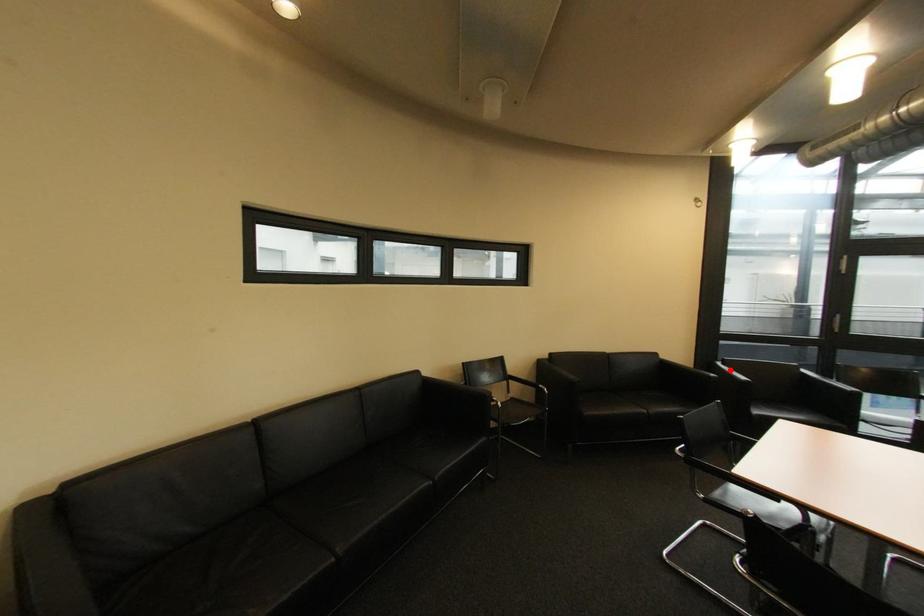
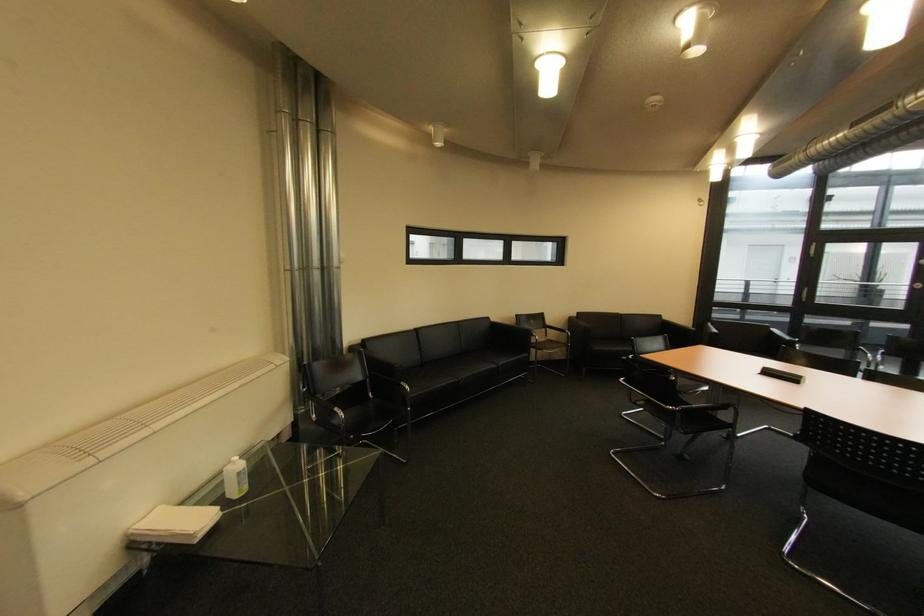
In the second image, find the point that corresponds to the highlighted location in the first image.

(716, 329)